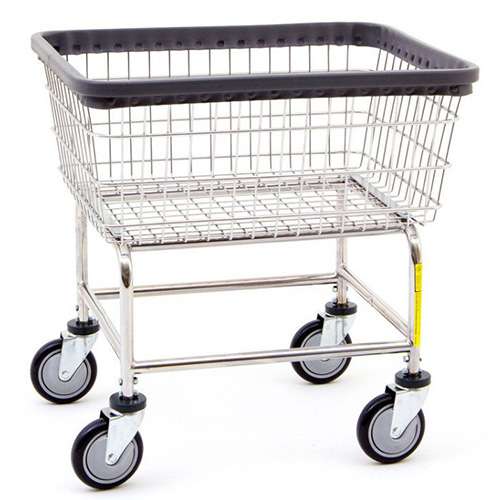
Locate an element on the screen. Image resolution: width=497 pixels, height=500 pixels. legs of cart is located at coordinates (79, 255), (120, 313), (338, 247), (418, 303).